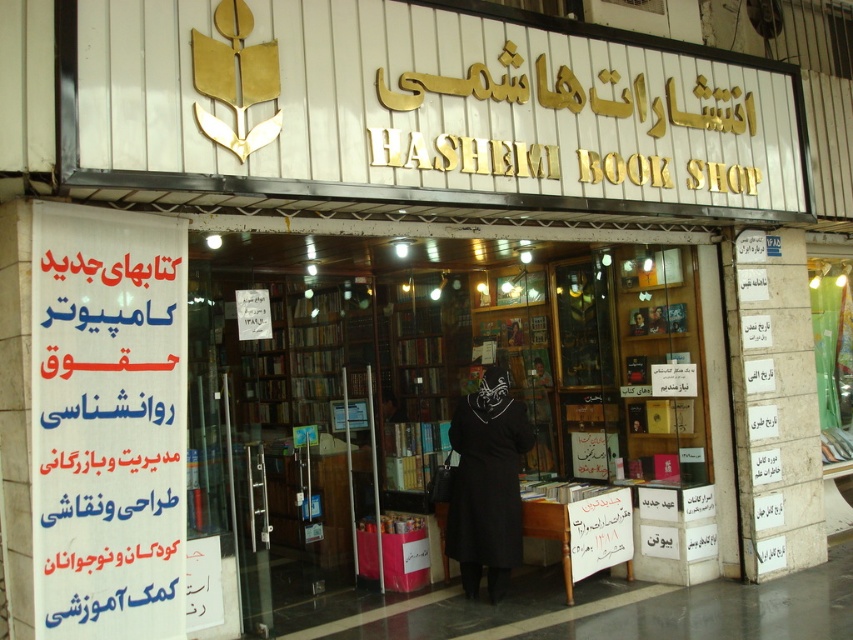
Question: Is white paper banner at left to the left of black matte dress at center from the viewer's perspective?

Choices:
 (A) no
 (B) yes

Answer: (B)

Question: Which point is closer to the camera?

Choices:
 (A) white paper banner at left
 (B) black matte dress at center

Answer: (A)

Question: Which object appears farthest from the camera in this image?

Choices:
 (A) white paper banner at left
 (B) black matte dress at center

Answer: (B)

Question: Does white paper banner at left have a lesser width compared to black matte dress at center?

Choices:
 (A) no
 (B) yes

Answer: (B)

Question: Does white paper banner at left lie in front of black matte dress at center?

Choices:
 (A) no
 (B) yes

Answer: (B)